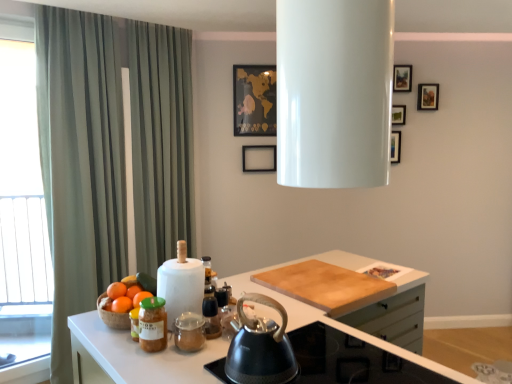
Question: Does matte glass jar at lower left have a lesser height compared to black matte picture frame at center, marked as the second picture frame in a left-to-right arrangement?

Choices:
 (A) yes
 (B) no

Answer: (A)

Question: Are matte glass jar at lower left and black matte picture frame at center, marked as the second picture frame in a left-to-right arrangement, located far from each other?

Choices:
 (A) no
 (B) yes

Answer: (B)

Question: Does matte glass jar at lower left have a greater width compared to black matte picture frame at center, which is the 3th picture frame in right-to-left order?

Choices:
 (A) yes
 (B) no

Answer: (A)

Question: Does matte glass jar at lower left lie in front of black matte picture frame at center, marked as the second picture frame in a left-to-right arrangement?

Choices:
 (A) yes
 (B) no

Answer: (A)

Question: Considering the relative sizes of matte glass jar at lower left and black matte picture frame at center, marked as the second picture frame in a left-to-right arrangement, in the image provided, is matte glass jar at lower left taller than black matte picture frame at center, marked as the second picture frame in a left-to-right arrangement,?

Choices:
 (A) yes
 (B) no

Answer: (B)

Question: Based on their sizes in the image, would you say white glossy countertop at lower left is bigger or smaller than matte glass jar at lower left?

Choices:
 (A) big
 (B) small

Answer: (A)

Question: In terms of height, does white glossy countertop at lower left look taller or shorter compared to matte glass jar at lower left?

Choices:
 (A) tall
 (B) short

Answer: (A)

Question: Does point click(x=245, y=288) appear closer or farther from the camera than point click(x=154, y=316)?

Choices:
 (A) closer
 (B) farther

Answer: (B)

Question: From the image's perspective, is white glossy countertop at lower left above or below matte glass jar at lower left?

Choices:
 (A) above
 (B) below

Answer: (B)

Question: Considering the relative positions of green striped curtain at left and white paper towel at center, which appears as the first appliance when viewed from the left, in the image provided, is green striped curtain at left to the left or to the right of white paper towel at center, which appears as the first appliance when viewed from the left,?

Choices:
 (A) right
 (B) left

Answer: (B)

Question: Considering the positions of green striped curtain at left and white paper towel at center, the 1th appliance when ordered from back to front, in the image, is green striped curtain at left wider or thinner than white paper towel at center, the 1th appliance when ordered from back to front,?

Choices:
 (A) thin
 (B) wide

Answer: (B)

Question: In terms of height, does green striped curtain at left look taller or shorter compared to white paper towel at center, which is the 2th appliance in front-to-back order?

Choices:
 (A) tall
 (B) short

Answer: (A)

Question: Which is correct: green striped curtain at left is inside white paper towel at center, which is the 2th appliance in front-to-back order, or outside of it?

Choices:
 (A) inside
 (B) outside

Answer: (B)

Question: Is matte glass jar at lower left taller or shorter than white sheer curtain at left?

Choices:
 (A) tall
 (B) short

Answer: (B)

Question: Is matte glass jar at lower left in front of or behind white sheer curtain at left in the image?

Choices:
 (A) behind
 (B) front

Answer: (B)